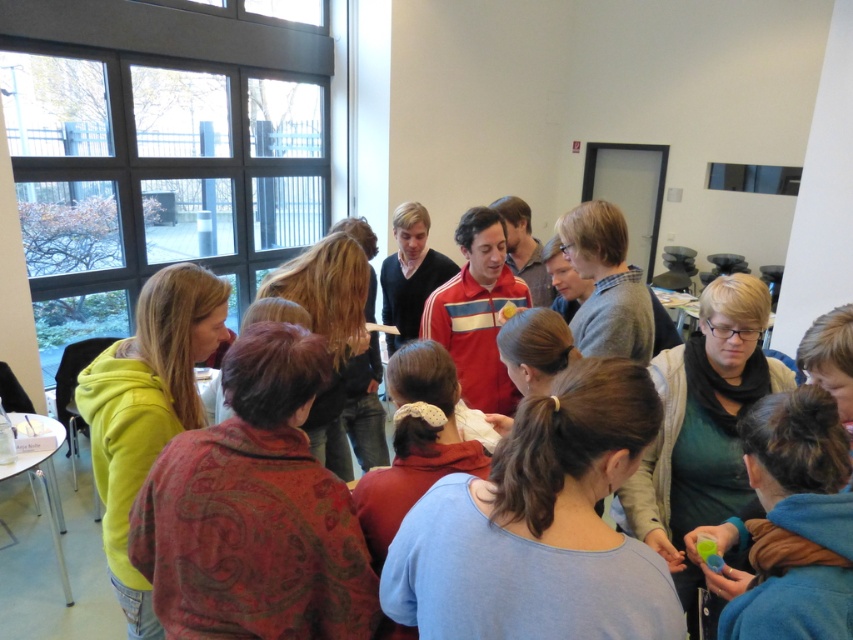
Question: Can you confirm if light blue fabric shirt at center is thinner than matte yellow hoodie at left?

Choices:
 (A) yes
 (B) no

Answer: (B)

Question: Where is light blue fabric shirt at center located in relation to matte yellow hoodie at left in the image?

Choices:
 (A) left
 (B) right

Answer: (B)

Question: Is light blue fabric shirt at center smaller than matte yellow hoodie at left?

Choices:
 (A) no
 (B) yes

Answer: (B)

Question: Which object is farther from the camera taking this photo?

Choices:
 (A) light blue fabric shirt at center
 (B) matte yellow hoodie at left

Answer: (B)